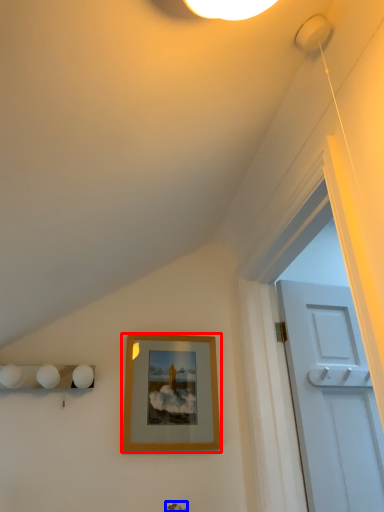
Question: Which object appears farthest to the camera in this image, picture frame (highlighted by a red box) or door handle (highlighted by a blue box)?

Choices:
 (A) picture frame
 (B) door handle

Answer: (A)